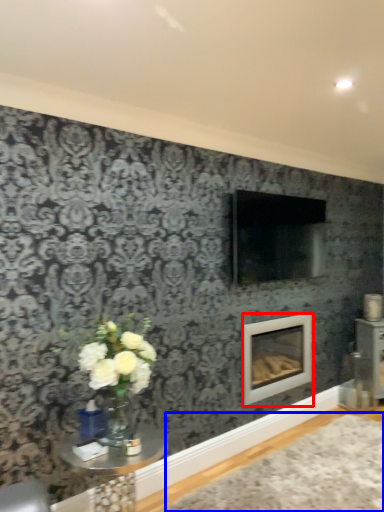
Question: Which point is further to the camera, fireplace (highlighted by a red box) or plain (highlighted by a blue box)?

Choices:
 (A) fireplace
 (B) plain

Answer: (A)